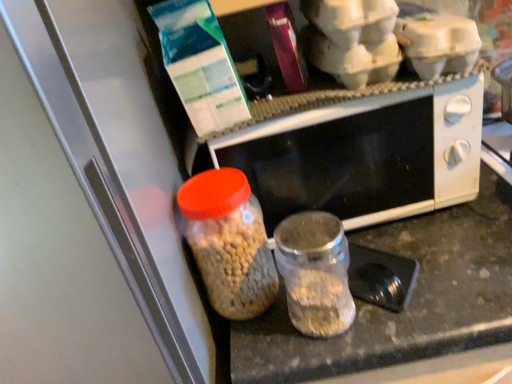
Question: Is translucent glass jar at center, the second bottle from the right, inside the boundaries of black matte microwave at center, or outside?

Choices:
 (A) inside
 (B) outside

Answer: (B)

Question: From a real-world perspective, relative to black matte microwave at center, is translucent glass jar at center, which ranks as the 1th bottle in left-to-right order, vertically above or below?

Choices:
 (A) below
 (B) above

Answer: (A)

Question: Which is nearer to the transparent glass jar at center, which is counted as the second bottle, starting from the left?

Choices:
 (A) black matte microwave at center
 (B) translucent glass jar at center, which ranks as the 1th bottle in left-to-right order

Answer: (B)

Question: Which object is the closest to the transparent glass jar at center, acting as the first bottle starting from the right?

Choices:
 (A) black matte microwave at center
 (B) translucent glass jar at center, which ranks as the 1th bottle in left-to-right order

Answer: (B)